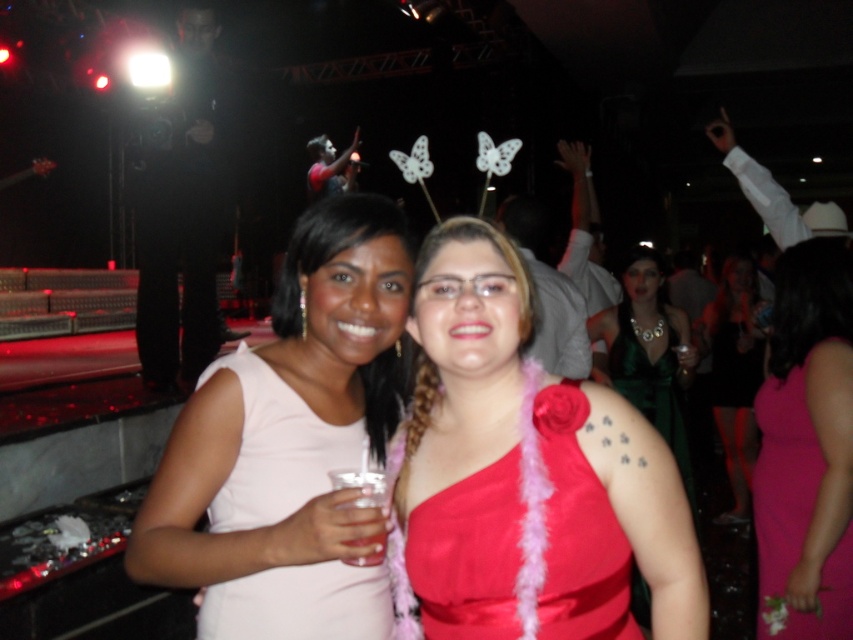
You are a photographer at the event and want to capture a photo of both the white matte dress at center and the green satin dress at center. Based on their positions, which dress is closer to the camera?

The white matte dress at center is below the green satin dress at center, so the green satin dress at center is closer to the camera.